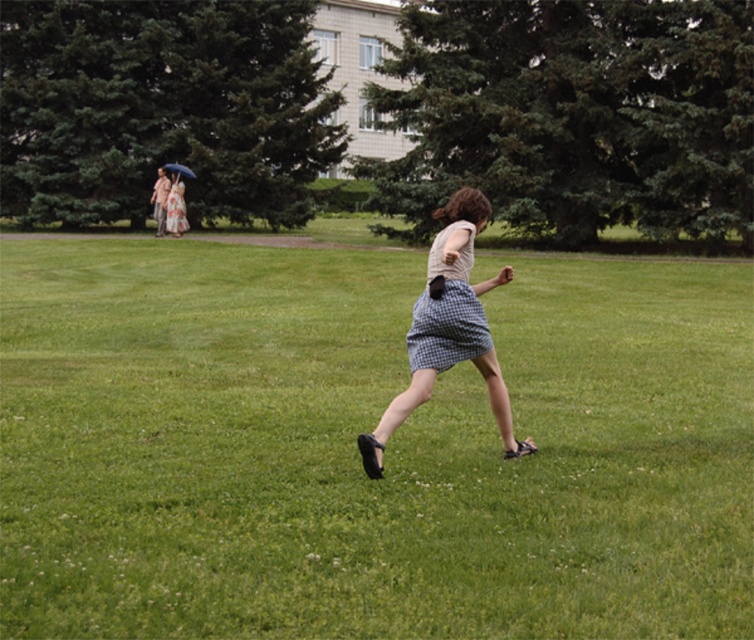
Question: Which object is the farthest from the matte white dress at upper left?

Choices:
 (A) checkered fabric skirt at center
 (B) checkered fabric dress at center
 (C) green grass at center

Answer: (B)

Question: Does green grass at center appear on the left side of checkered fabric dress at center?

Choices:
 (A) yes
 (B) no

Answer: (A)

Question: Which of these objects is positioned closest to the matte white dress at upper left?

Choices:
 (A) checkered fabric dress at center
 (B) checkered fabric skirt at center
 (C) green grass at center

Answer: (B)

Question: Which point is closer to the camera?

Choices:
 (A) checkered fabric dress at center
 (B) checkered fabric skirt at center

Answer: (B)

Question: Does green grass at center have a smaller size compared to checkered fabric skirt at center?

Choices:
 (A) yes
 (B) no

Answer: (B)

Question: Does green grass at center come in front of matte white dress at upper left?

Choices:
 (A) yes
 (B) no

Answer: (A)